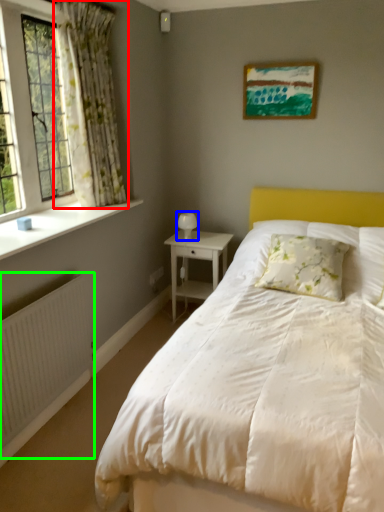
Question: Estimate the real-world distances between objects in this image. Which object is closer to curtain (highlighted by a red box), table lamp (highlighted by a blue box) or radiator (highlighted by a green box)?

Choices:
 (A) table lamp
 (B) radiator

Answer: (A)